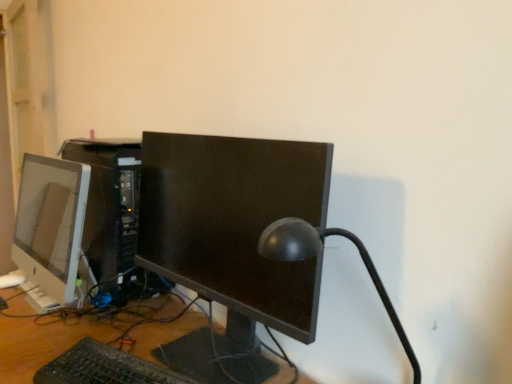
You are a GUI agent. You are given a task and a screenshot of the screen. Output one action in this format:
    pyautogui.click(x=<x>, y=<y>)
    Task: Click on the vacant space situated above wooden desk at center (from a real-world perspective)
    The height and width of the screenshot is (384, 512).
    Given the screenshot: What is the action you would take?
    pyautogui.click(x=122, y=325)